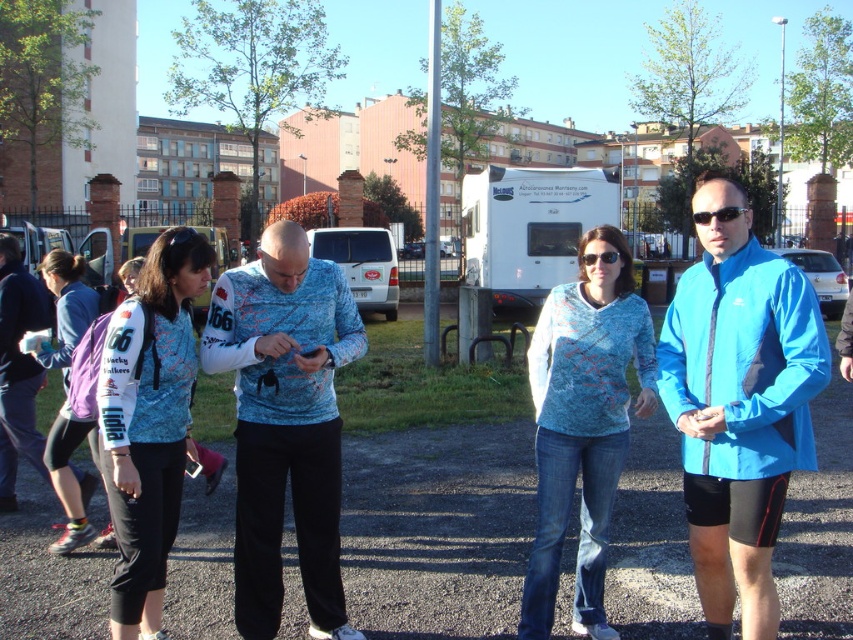
Does matte blue vest at center have a lesser height compared to purple fabric backpack at left?

In fact, matte blue vest at center may be taller than purple fabric backpack at left.

Who is positioned more to the right, matte blue vest at center or purple fabric backpack at left?

From the viewer's perspective, matte blue vest at center appears more on the right side.

Which is behind, point (148, 358) or point (51, 440)?

The point (51, 440) is behind.

The image size is (853, 640). I want to click on matte blue vest at center, so click(x=149, y=422).

Between textured blue sweater at center and purple fabric backpack at left, which one appears on the right side from the viewer's perspective?

textured blue sweater at center

From the picture: Can you confirm if textured blue sweater at center is thinner than purple fabric backpack at left?

Correct, textured blue sweater at center's width is less than purple fabric backpack at left's.

Who is more distant from viewer, (625, 417) or (65, 476)?

The point (65, 476) is more distant.

Where is `textured blue sweater at center`? The width and height of the screenshot is (853, 640). textured blue sweater at center is located at coordinates (583, 422).

Does textured blue sweater at center lie in front of matte blue vest at center?

No.

What do you see at coordinates (583, 422) in the screenshot? I see `textured blue sweater at center` at bounding box center [583, 422].

Locate an element on the screen. The height and width of the screenshot is (640, 853). textured blue sweater at center is located at coordinates (583, 422).